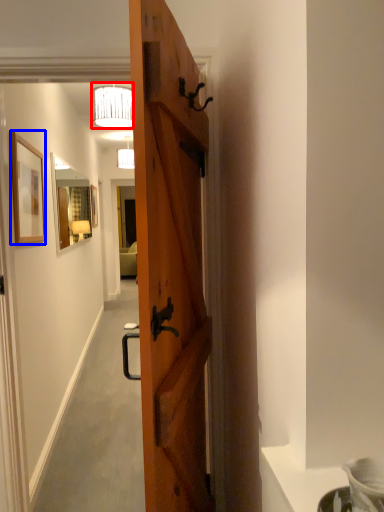
Question: Which object appears closest to the camera in this image, lamp (highlighted by a red box) or picture frame (highlighted by a blue box)?

Choices:
 (A) lamp
 (B) picture frame

Answer: (B)